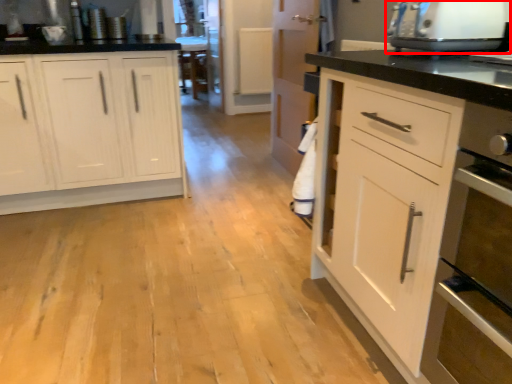
Question: From the image's perspective, where is home appliance (annotated by the red box) located relative to cabinetry?

Choices:
 (A) above
 (B) below

Answer: (A)